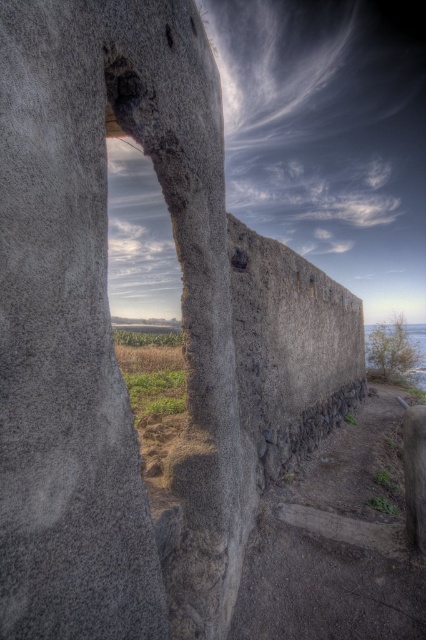
Can you confirm if gray rough concrete crack at center is shorter than smooth concrete hole at center?

Yes.

What are the coordinates of `gray rough concrete crack at center` in the screenshot? It's located at (379, 602).

Does gray rough concrete crack at center come behind smooth stone hole at upper center?

Yes.

Is gray rough concrete crack at center positioned in front of smooth stone hole at upper center?

No.

Find the location of a particular element. Image resolution: width=426 pixels, height=640 pixels. gray rough concrete crack at center is located at coordinates (379, 602).

Between smooth concrete hole at center and smooth stone hole at upper center, which one has more height?

Standing taller between the two is smooth concrete hole at center.

Measure the distance between point (167, 29) and camera.

Point (167, 29) is 2.39 meters away from camera.

Is point (169, 45) closer to viewer compared to point (192, 22)?

Yes, it is.

Where is `smooth concrete hole at center`? This screenshot has height=640, width=426. smooth concrete hole at center is located at coordinates (169, 35).